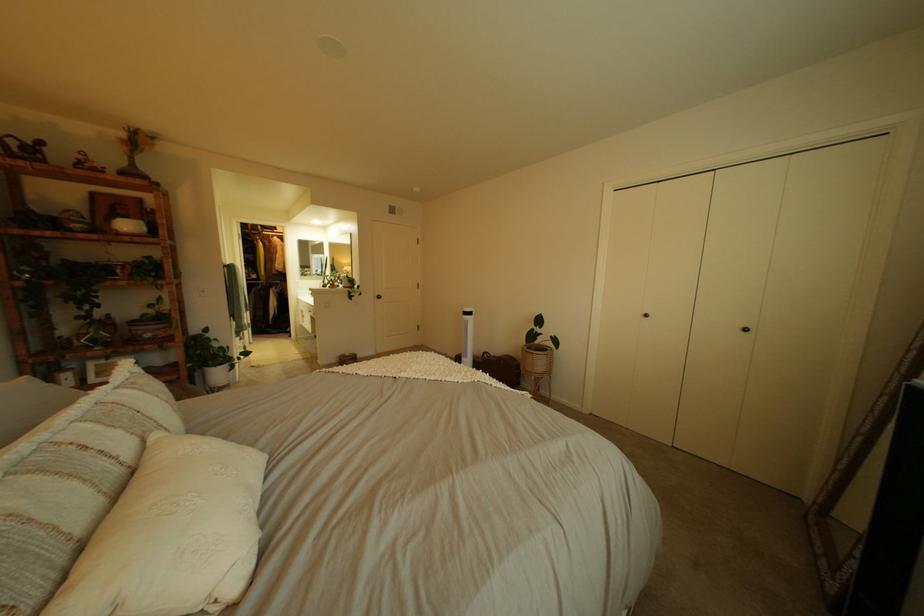
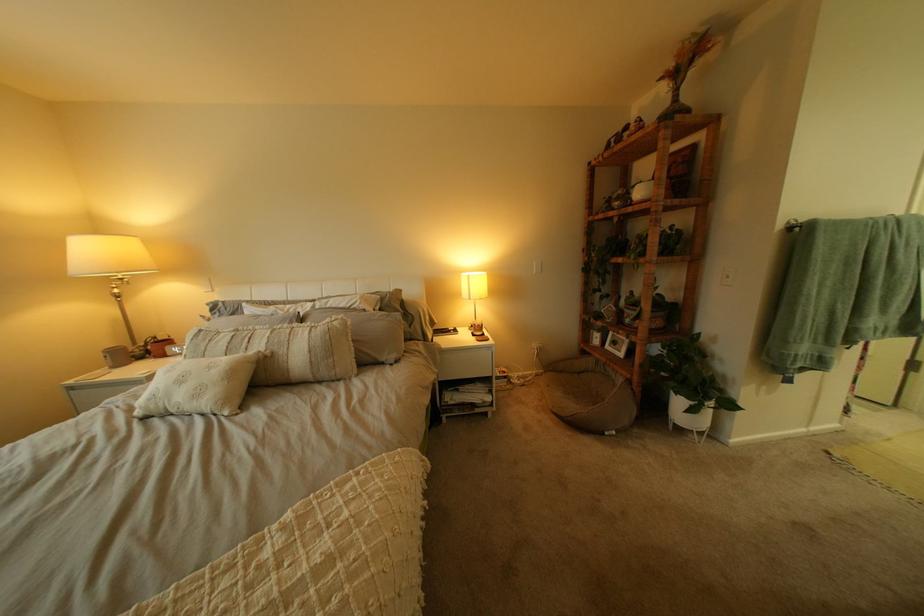
In the second image, find the point that corresponds to point 225,363 in the first image.

(687, 385)